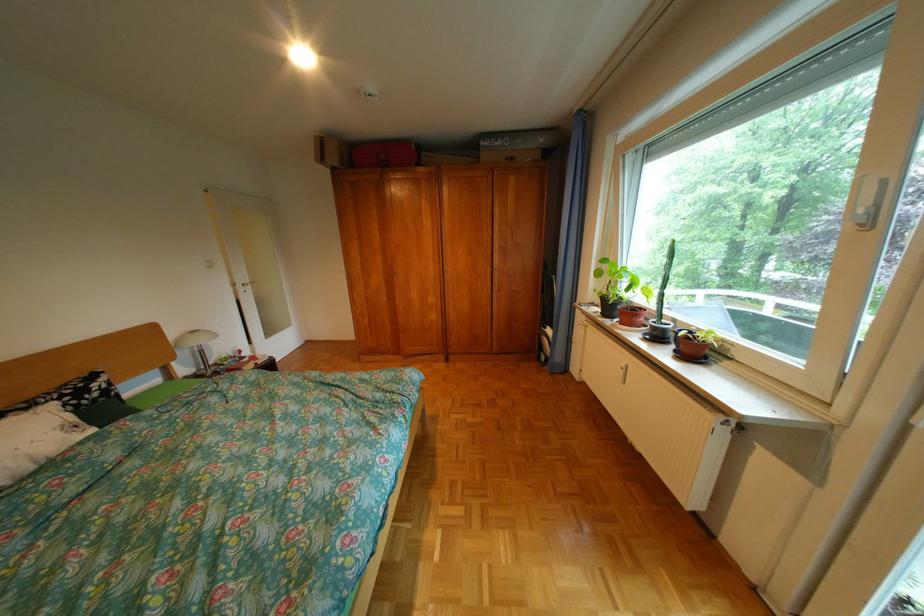
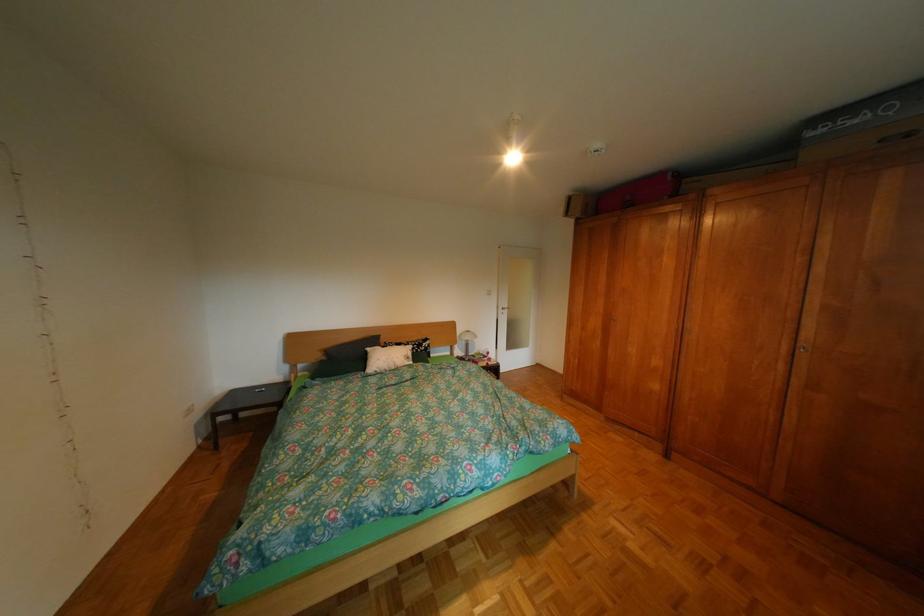
Question: The first image is from the beginning of the video and the second image is from the end. How did the camera likely rotate when shooting the video?

Choices:
 (A) Left
 (B) Right
 (C) Up
 (D) Down

Answer: (A)